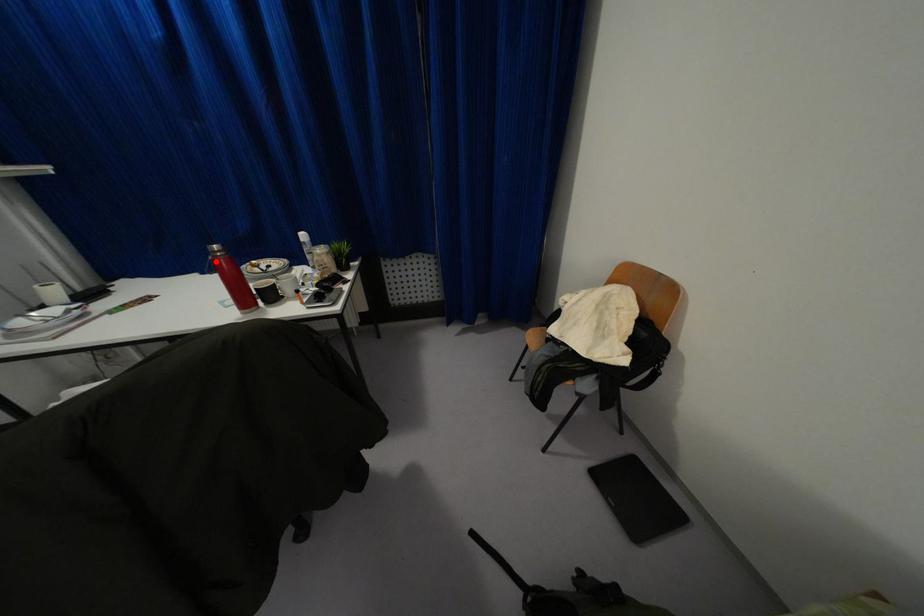
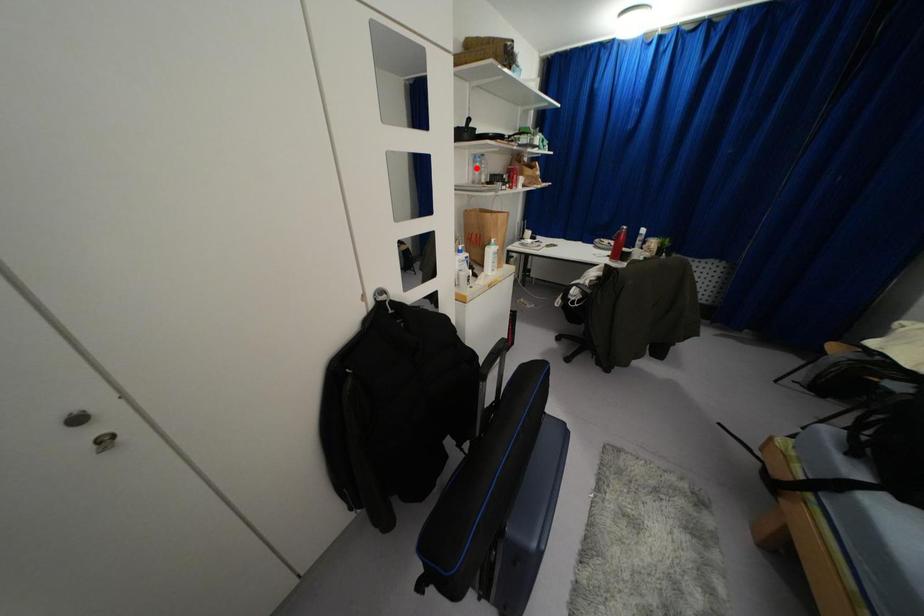
I am providing you with two images of the same scene from different viewpoints. A red point is marked on the first image and another point is marked on the second image. Is the marked point in image1 the same physical position as the marked point in image2?

No